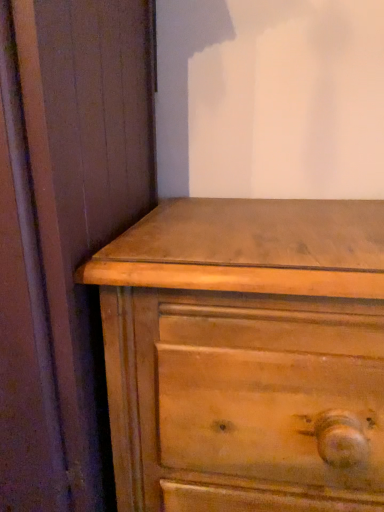
Where is `vacant space situated above light brown wood chest of drawers at center (from a real-world perspective)`? The height and width of the screenshot is (512, 384). vacant space situated above light brown wood chest of drawers at center (from a real-world perspective) is located at coordinates (243, 230).